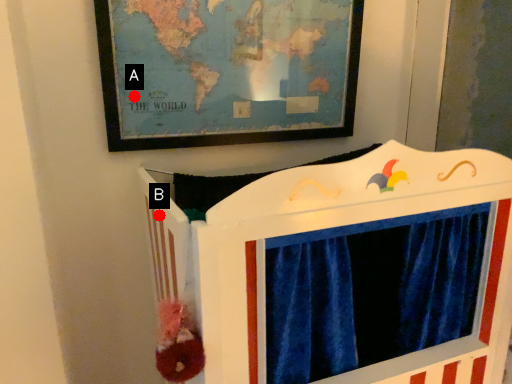
Question: Two points are circled on the image, labeled by A and B beside each circle. Which point is further to the camera?

Choices:
 (A) A is further
 (B) B is further

Answer: (A)